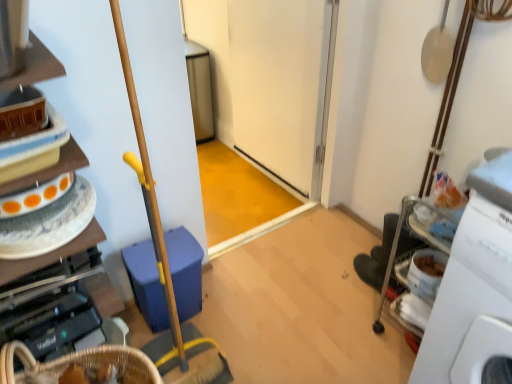
Question: Can you confirm if white plastic machine at right is bigger than wooden cabinet at left?

Choices:
 (A) no
 (B) yes

Answer: (B)

Question: Is white plastic machine at right facing away from wooden cabinet at left?

Choices:
 (A) yes
 (B) no

Answer: (B)

Question: From a real-world perspective, is white plastic machine at right positioned under wooden cabinet at left based on gravity?

Choices:
 (A) no
 (B) yes

Answer: (B)

Question: Is white plastic machine at right at the right side of wooden cabinet at left?

Choices:
 (A) no
 (B) yes

Answer: (B)

Question: Is white plastic machine at right smaller than wooden cabinet at left?

Choices:
 (A) yes
 (B) no

Answer: (B)

Question: From the image's perspective, is white plastic machine at right beneath wooden cabinet at left?

Choices:
 (A) no
 (B) yes

Answer: (B)

Question: From the image's perspective, is wooden cabinet at left over white plastic machine at right?

Choices:
 (A) yes
 (B) no

Answer: (A)

Question: From a real-world perspective, is wooden cabinet at left under white plastic machine at right?

Choices:
 (A) no
 (B) yes

Answer: (A)

Question: Is wooden cabinet at left surrounding white plastic machine at right?

Choices:
 (A) yes
 (B) no

Answer: (B)

Question: Is wooden cabinet at left closer to camera compared to white plastic machine at right?

Choices:
 (A) yes
 (B) no

Answer: (B)

Question: Does wooden cabinet at left lie behind white plastic machine at right?

Choices:
 (A) no
 (B) yes

Answer: (B)

Question: Is wooden cabinet at left not within white plastic machine at right?

Choices:
 (A) no
 (B) yes

Answer: (B)

Question: From the image's perspective, relative to wooden cabinet at left, is white plastic machine at right above or below?

Choices:
 (A) above
 (B) below

Answer: (B)